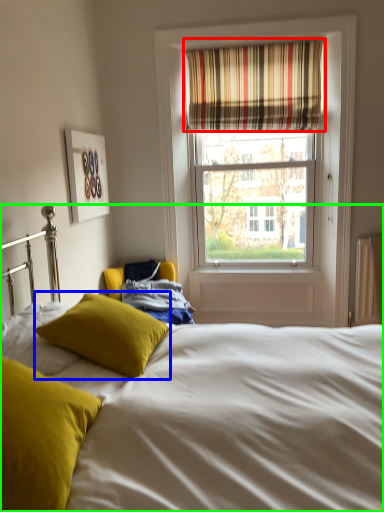
Question: Based on their relative distances, which object is nearer to curtain (highlighted by a red box)? Choose from pillow (highlighted by a blue box) and bed (highlighted by a green box).

Choices:
 (A) pillow
 (B) bed

Answer: (A)